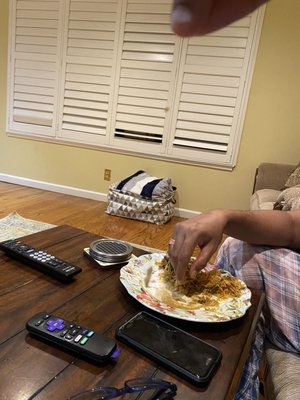
You are a GUI agent. You are given a task and a screenshot of the screen. Output one action in this format:
    pyautogui.click(x=<x>, y=<y>)
    Task: Click on the carpet
    Image resolution: width=300 pixels, height=400 pixels.
    Given the screenshot: What is the action you would take?
    pyautogui.click(x=22, y=223)